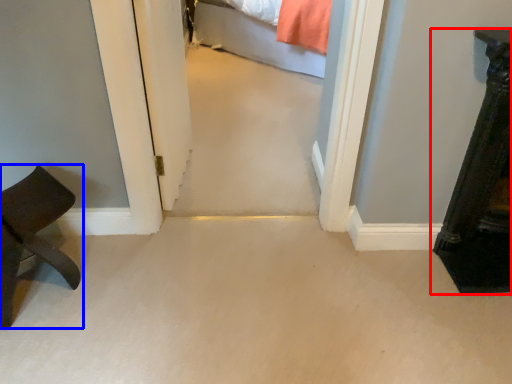
Question: Among these objects, which one is nearest to the camera, furniture (highlighted by a red box) or furniture (highlighted by a blue box)?

Choices:
 (A) furniture
 (B) furniture

Answer: (B)